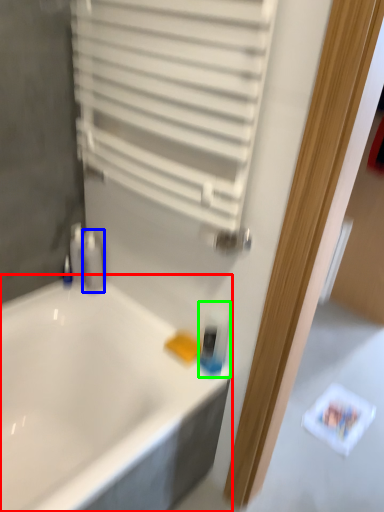
Question: Which object is the farthest from bathtub (highlighted by a red box)? Choose among these: toiletry (highlighted by a blue box) or mouthwash (highlighted by a green box).

Choices:
 (A) toiletry
 (B) mouthwash

Answer: (A)